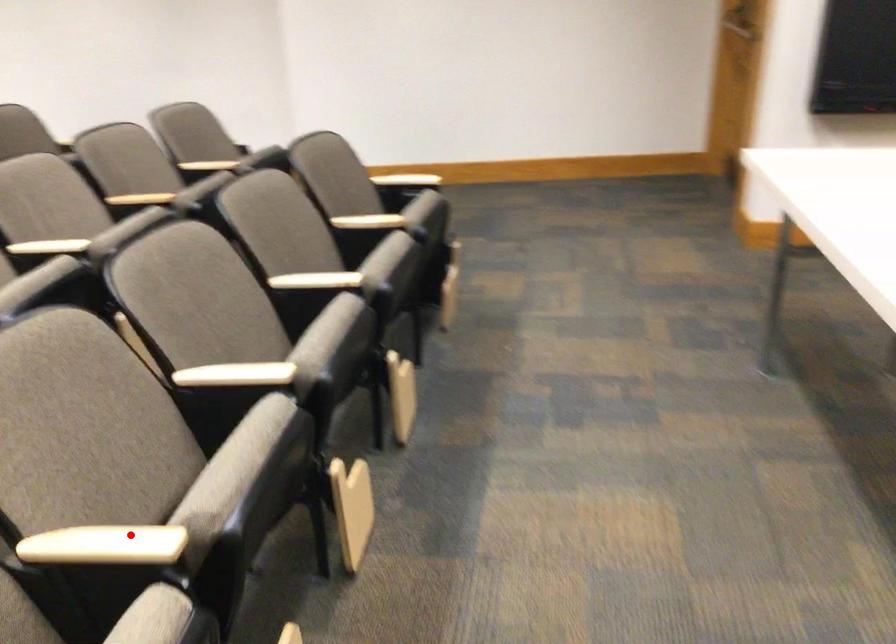
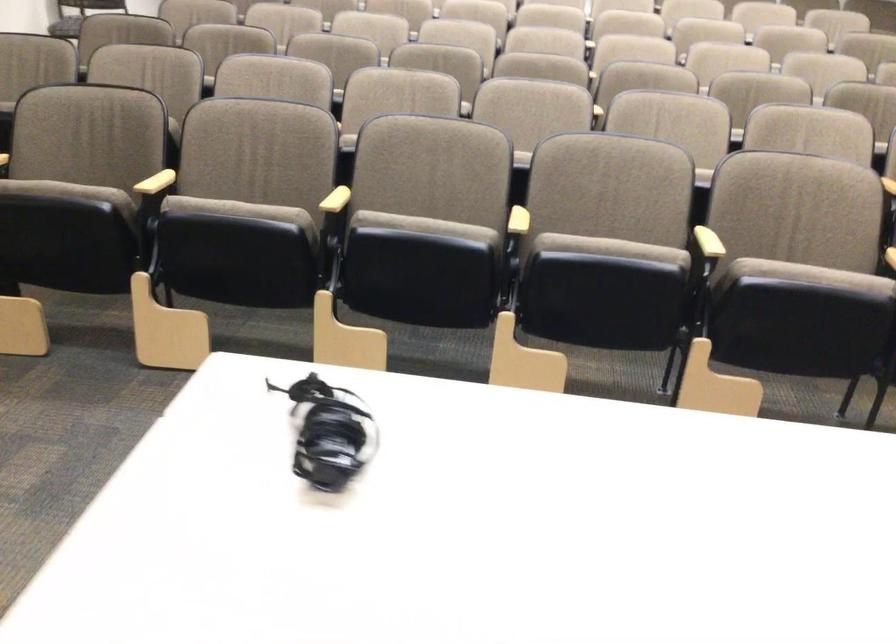
Locate, in the second image, the point that corresponds to the highlighted location in the first image.

(336, 200)